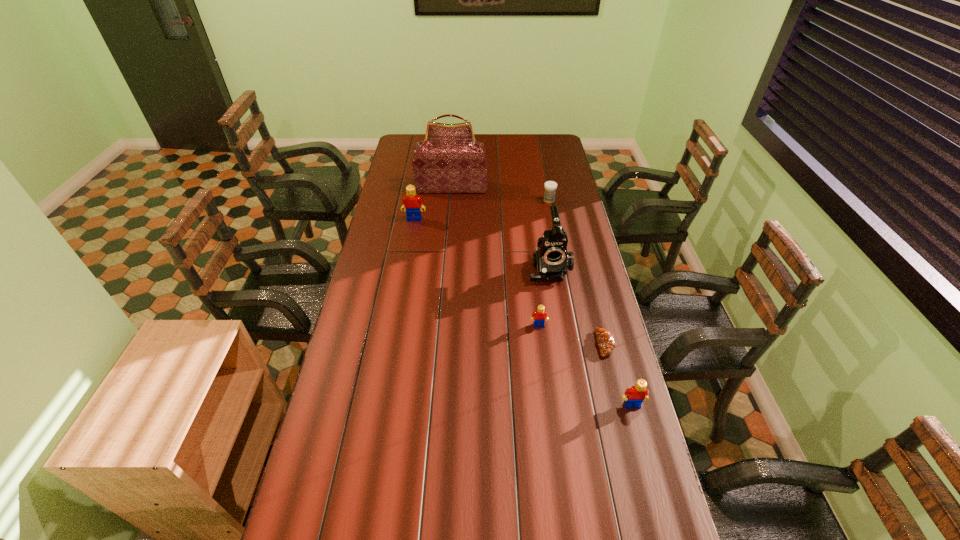
Image resolution: width=960 pixels, height=540 pixels. Identify the location of Lego situated at the left edge. (411, 202).

Find the location of a particular element. This screenshot has height=540, width=960. handbag present at the left edge is located at coordinates (449, 160).

Where is `Lego that is positioned at the right edge`? The height and width of the screenshot is (540, 960). Lego that is positioned at the right edge is located at coordinates (634, 396).

I want to click on medicine located at the right edge, so click(x=550, y=187).

Where is `camcorder present at the right edge`? camcorder present at the right edge is located at coordinates (551, 260).

This screenshot has width=960, height=540. Find the location of `crescent roll at the right edge`. crescent roll at the right edge is located at coordinates (605, 339).

At what (x,y) coordinates should I click in order to perform the action: click on vacant space at the left edge of the desktop. Please return your answer as a coordinate pair (x, y). Looking at the image, I should click on (330, 426).

Locate an element on the screen. The image size is (960, 540). vacant space at the right edge of the desktop is located at coordinates click(594, 350).

The width and height of the screenshot is (960, 540). What are the coordinates of `vacant region between the second farthest Lego and the crescent roll` in the screenshot? It's located at (572, 335).

Find the location of a particular element. This screenshot has width=960, height=540. unoccupied area between the sixth nearest object and the handbag is located at coordinates (500, 194).